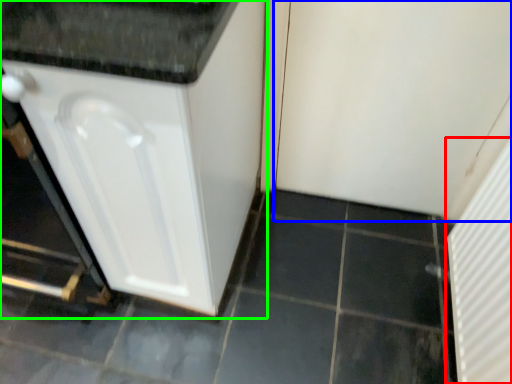
Question: Estimate the real-world distances between objects in this image. Which object is closer to screen door (highlighted by a red box), screen door (highlighted by a blue box) or cabinetry (highlighted by a green box)?

Choices:
 (A) screen door
 (B) cabinetry

Answer: (A)